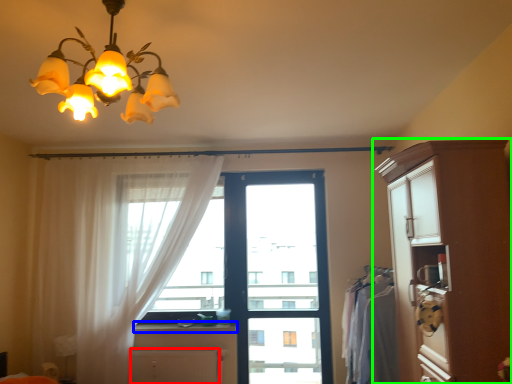
Question: Which object is positioned farthest from cabinetry (highlighted by a red box)? Select from counter top (highlighted by a blue box) and cabinetry (highlighted by a green box).

Choices:
 (A) counter top
 (B) cabinetry

Answer: (B)